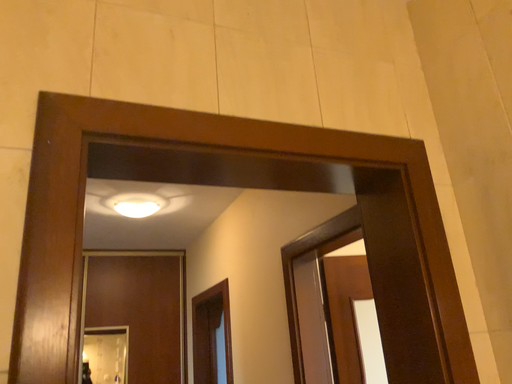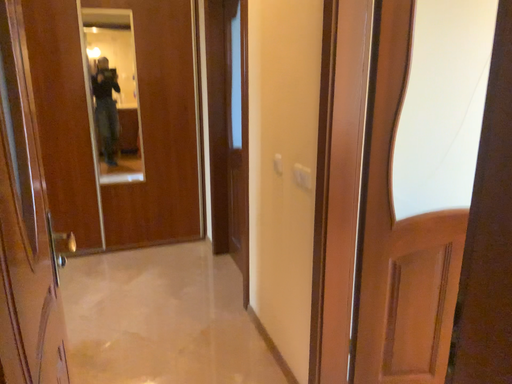
Question: How did the camera likely rotate when shooting the video?

Choices:
 (A) rotated upward
 (B) rotated downward

Answer: (B)